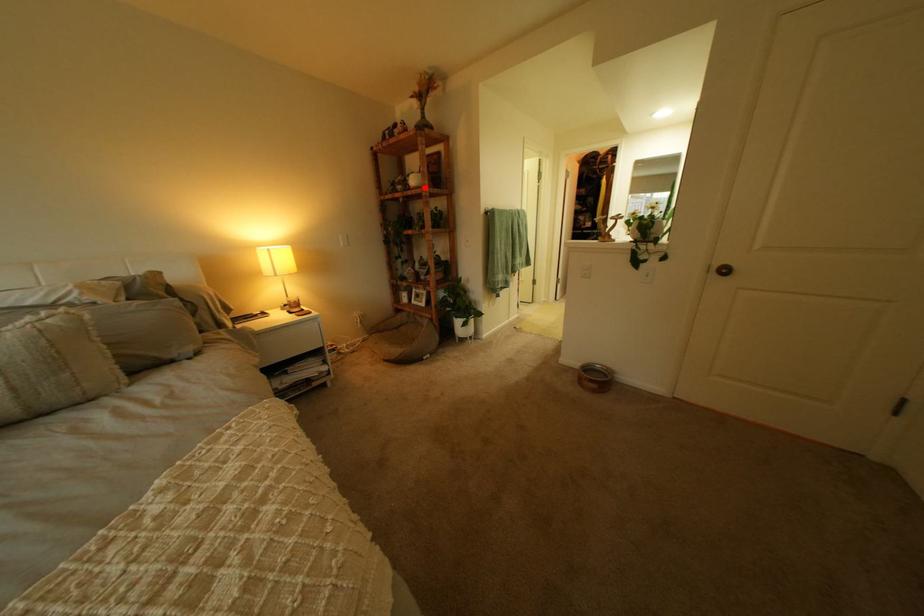
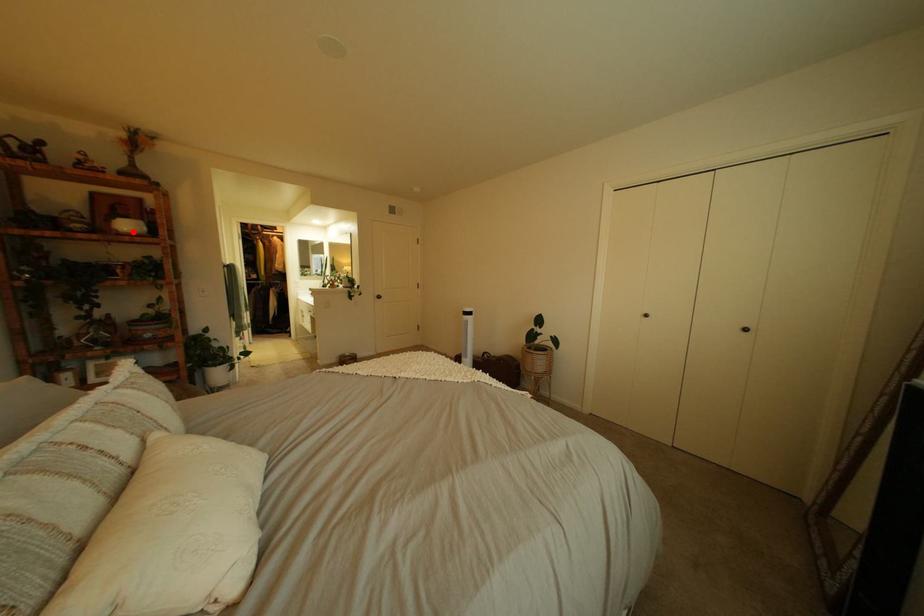
I am providing you with two images of the same scene from different viewpoints. A red point is marked on the first image and another point is marked on the second image. Do the highlighted points in image1 and image2 indicate the same real-world spot?

Yes